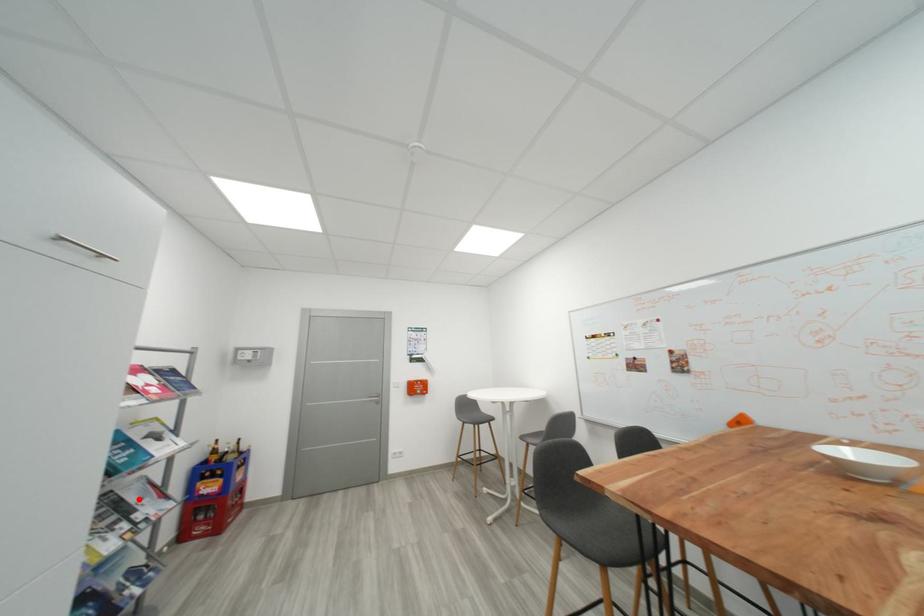
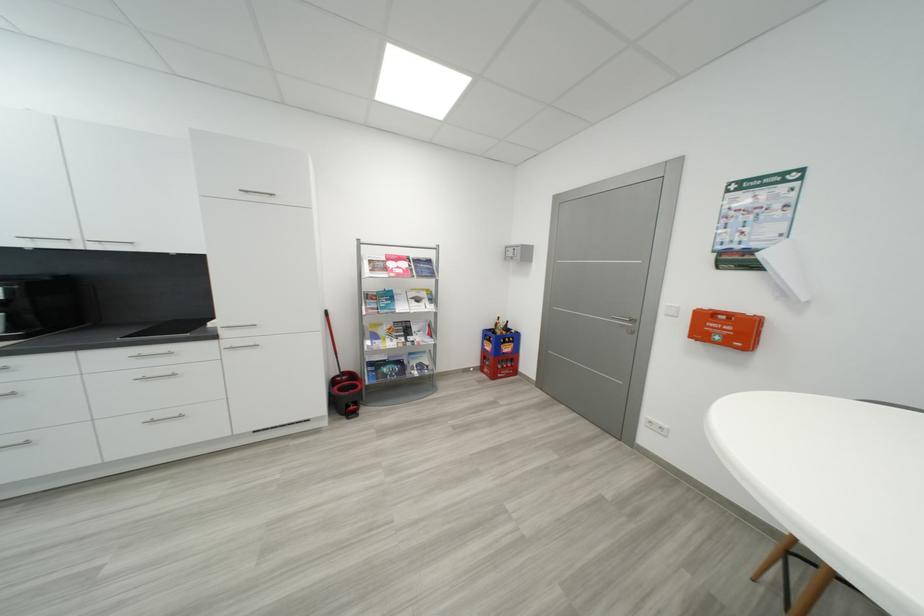
In the second image, find the point that corresponds to the highlighted location in the first image.

(421, 330)